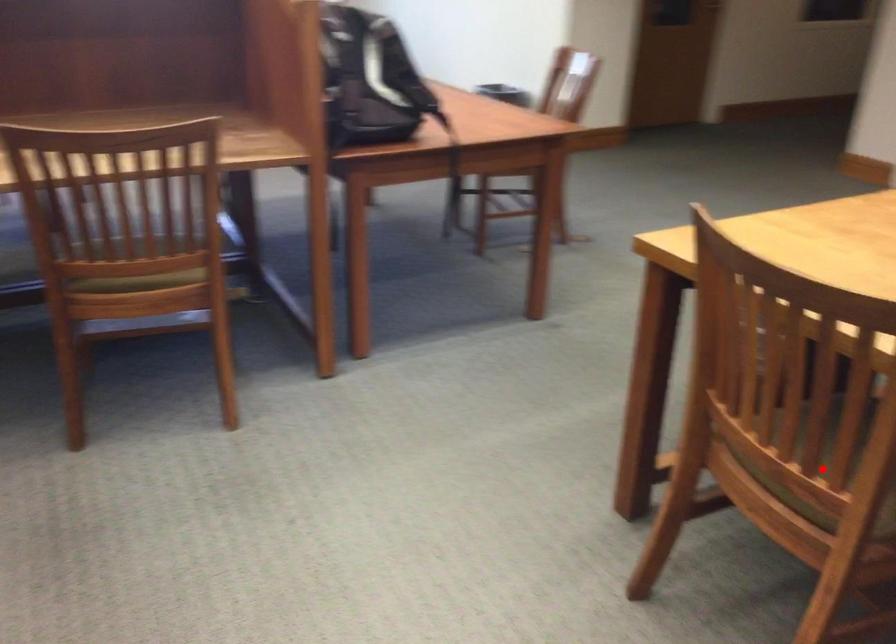
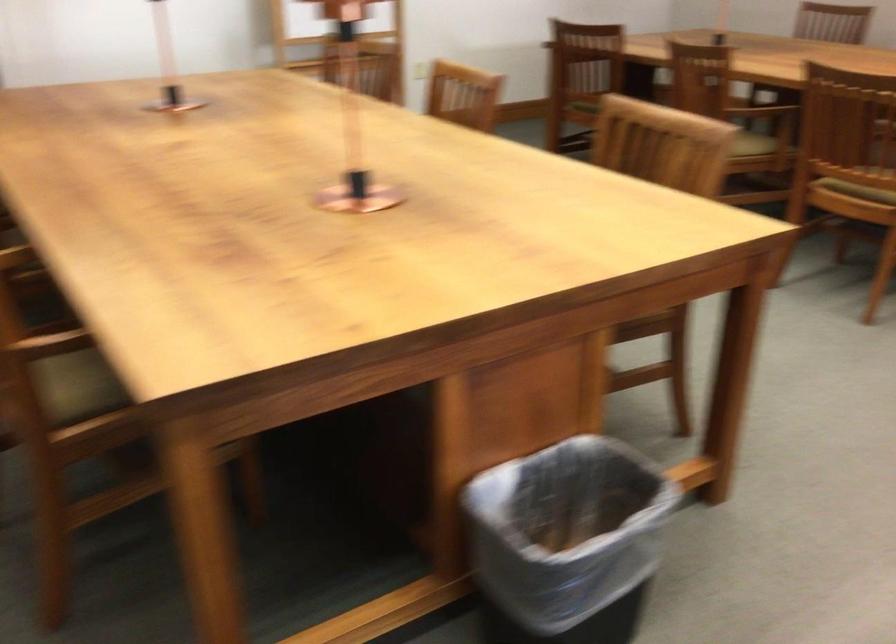
Question: I am providing you with two images of the same scene from different viewpoints. A red point is marked on the first image. Can you still see the location of the red point in image 2?

Choices:
 (A) Yes
 (B) No

Answer: (B)